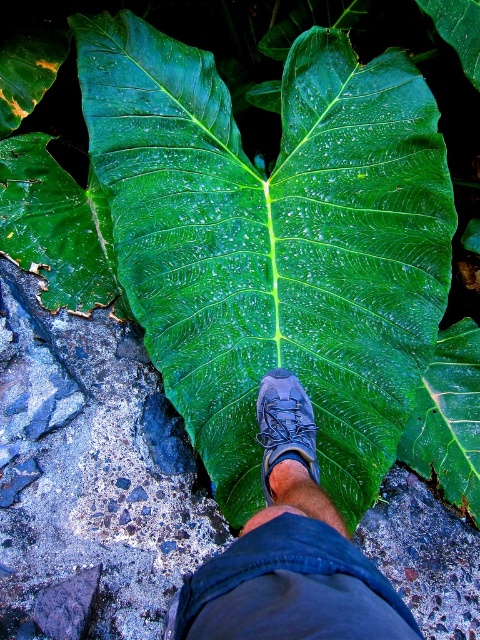
Does green glossy leaf at center have a greater height compared to dark gray leather shoe at center?

Correct, green glossy leaf at center is much taller as dark gray leather shoe at center.

Based on the photo, is green glossy leaf at center wider than dark gray leather shoe at center?

Yes.

Where is `green glossy leaf at center`? The height and width of the screenshot is (640, 480). green glossy leaf at center is located at coordinates (275, 243).

In the scene shown: Is green glossy leaf at center wider than matte blue shoe at center?

Yes.

Is green glossy leaf at center behind matte blue shoe at center?

Yes, it is.

Find the location of a particular element. The height and width of the screenshot is (640, 480). green glossy leaf at center is located at coordinates (275, 243).

Can you confirm if dark gray leather shoe at center is positioned to the right of matte blue shoe at center?

Incorrect, dark gray leather shoe at center is not on the right side of matte blue shoe at center.

Is point (170, 630) in front of point (273, 422)?

That is True.

Is point (295, 385) positioned in front of point (257, 433)?

Yes.

At what (x,y) coordinates should I click in order to perform the action: click on dark gray leather shoe at center. Please return your answer as a coordinate pair (x, y). Looking at the image, I should click on (289, 552).